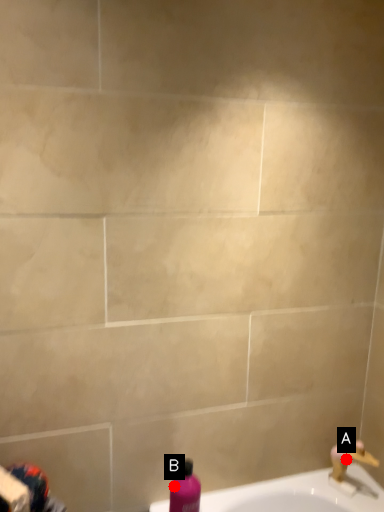
Question: Two points are circled on the image, labeled by A and B beside each circle. Which point is farther to the camera?

Choices:
 (A) A is further
 (B) B is further

Answer: (A)